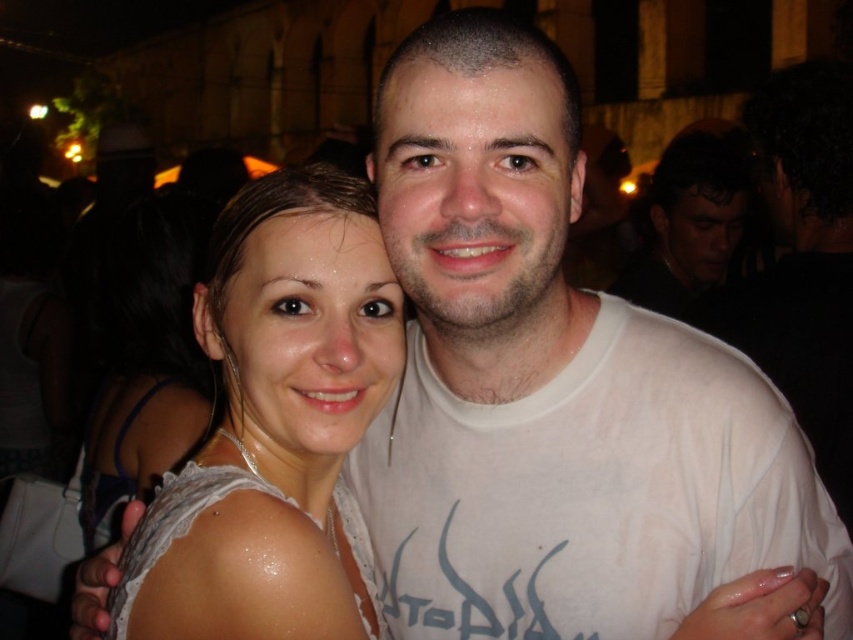
Between white cotton t-shirt at center and white lace dress at center, which one appears on the left side from the viewer's perspective?

white lace dress at center

Which is above, white cotton t-shirt at center or white lace dress at center?

white cotton t-shirt at center is higher up.

Which is behind, point (376, 177) or point (374, 369)?

The point (376, 177) is behind.

Identify the location of white cotton t-shirt at center. (560, 394).

Is point (250, 561) closer to camera compared to point (674, 252)?

Yes, point (250, 561) is closer to viewer.

Does white lace dress at center appear over matte white shirt at center?

No.

Does point (274, 323) lie behind point (665, 196)?

That is False.

You are a GUI agent. You are given a task and a screenshot of the screen. Output one action in this format:
    pyautogui.click(x=<x>, y=<y>)
    Task: Click on the white lace dress at center
    This screenshot has height=640, width=853.
    Given the screenshot: What is the action you would take?
    pyautogui.click(x=276, y=426)

Between point (434, 51) and point (665, 225), which one is positioned in front?

Positioned in front is point (434, 51).

Does white cotton t-shirt at center come in front of matte white shirt at center?

Yes, white cotton t-shirt at center is in front of matte white shirt at center.

Which is behind, point (682, 340) or point (677, 182)?

Positioned behind is point (677, 182).

Image resolution: width=853 pixels, height=640 pixels. Identify the location of white cotton t-shirt at center. (560, 394).